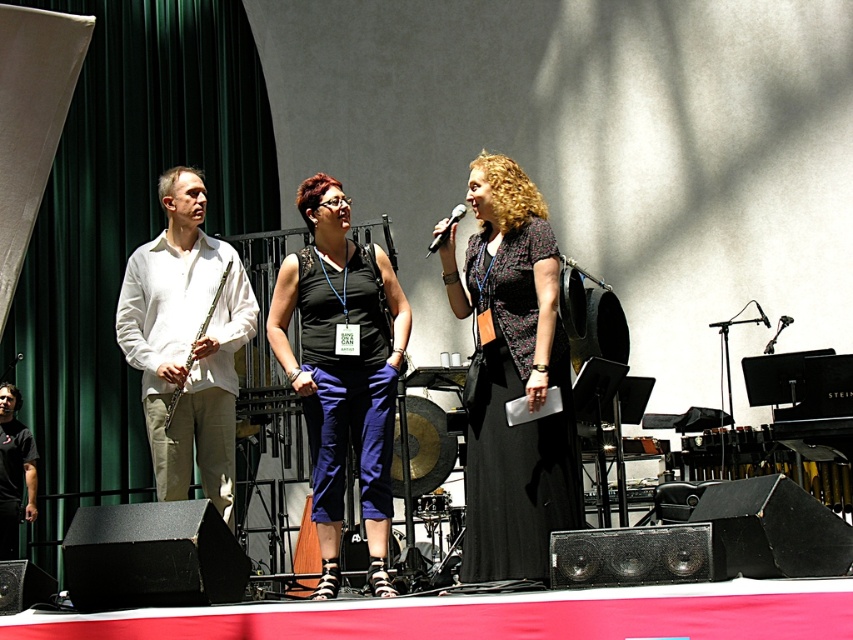
Which is below, black textured dress at center or black matte microphone at center?

black textured dress at center is lower down.

Does black textured dress at center appear over black matte microphone at center?

No, black textured dress at center is not above black matte microphone at center.

Which is behind, point (505, 348) or point (457, 218)?

The point (505, 348) is behind.

Locate an element on the screen. This screenshot has height=640, width=853. black textured dress at center is located at coordinates (515, 426).

Does black matte tank top at center have a greater width compared to matte silver flute at left?

Yes.

Between point (321, 330) and point (166, 413), which one is positioned in front?

Positioned in front is point (321, 330).

Where is `black matte tank top at center`? The image size is (853, 640). black matte tank top at center is located at coordinates (341, 371).

Is black textured dress at center to the left of matte silver flute at left from the viewer's perspective?

No, black textured dress at center is not to the left of matte silver flute at left.

Is point (550, 506) closer to camera compared to point (213, 304)?

Yes.

Is point (488, 560) positioned before point (194, 360)?

Yes, point (488, 560) is in front of point (194, 360).

Identify the location of black textured dress at center. The width and height of the screenshot is (853, 640). (515, 426).